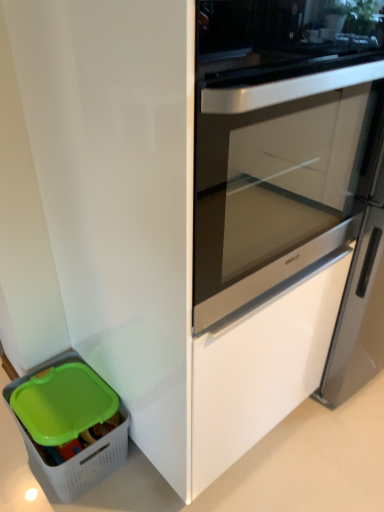
Question: Considering the relative sizes of white glossy screen door at center and white plastic basket at lower left in the image provided, is white glossy screen door at center bigger than white plastic basket at lower left?

Choices:
 (A) no
 (B) yes

Answer: (B)

Question: Is white glossy screen door at center not inside white plastic basket at lower left?

Choices:
 (A) yes
 (B) no

Answer: (A)

Question: Is white glossy screen door at center not close to white plastic basket at lower left?

Choices:
 (A) no
 (B) yes

Answer: (A)

Question: Is white glossy screen door at center in contact with white plastic basket at lower left?

Choices:
 (A) no
 (B) yes

Answer: (A)

Question: From the image's perspective, is white glossy screen door at center on top of white plastic basket at lower left?

Choices:
 (A) yes
 (B) no

Answer: (A)

Question: Does white glossy screen door at center lie behind white plastic basket at lower left?

Choices:
 (A) yes
 (B) no

Answer: (B)

Question: From a real-world perspective, is white plastic basket at lower left located beneath white glossy screen door at center?

Choices:
 (A) yes
 (B) no

Answer: (A)

Question: Does white plastic basket at lower left appear on the right side of white glossy screen door at center?

Choices:
 (A) yes
 (B) no

Answer: (B)

Question: From the image's perspective, is white plastic basket at lower left over white glossy screen door at center?

Choices:
 (A) yes
 (B) no

Answer: (B)

Question: Considering the relative sizes of white plastic basket at lower left and white glossy screen door at center in the image provided, is white plastic basket at lower left taller than white glossy screen door at center?

Choices:
 (A) no
 (B) yes

Answer: (A)

Question: Is white plastic basket at lower left positioned before white glossy screen door at center?

Choices:
 (A) yes
 (B) no

Answer: (B)

Question: Is white plastic basket at lower left facing towards white glossy screen door at center?

Choices:
 (A) yes
 (B) no

Answer: (B)

Question: Is white plastic basket at lower left inside the boundaries of white glossy screen door at center, or outside?

Choices:
 (A) inside
 (B) outside

Answer: (B)